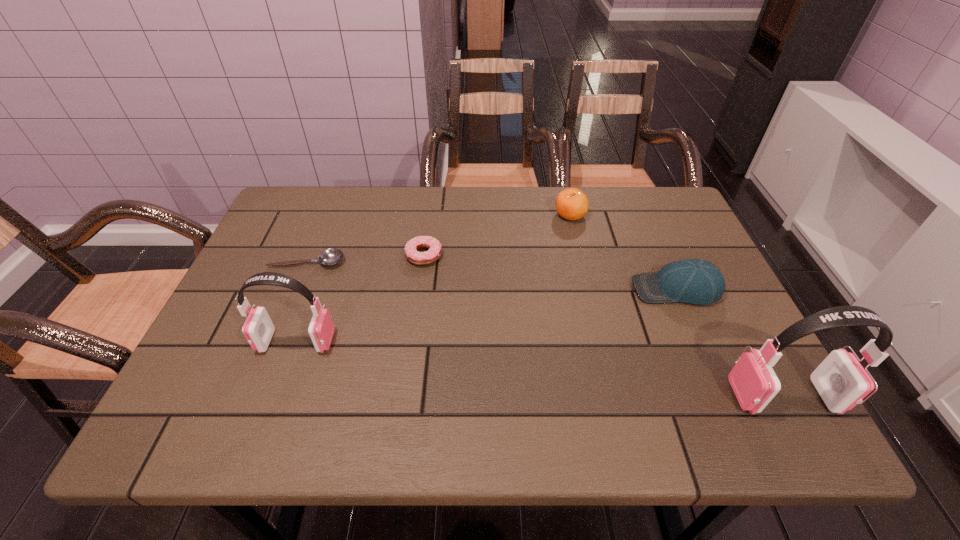
Find the location of a particular element. The height and width of the screenshot is (540, 960). object that stands as the second closest to the doughnut is located at coordinates (258, 329).

At what (x,y) coordinates should I click in order to perform the action: click on free space that satisfies the following two spatial constraints: 1. on the back side of the fifth tallest object; 2. on the right side of the farthest object. Please return your answer as a coordinate pair (x, y). The width and height of the screenshot is (960, 540). Looking at the image, I should click on (429, 215).